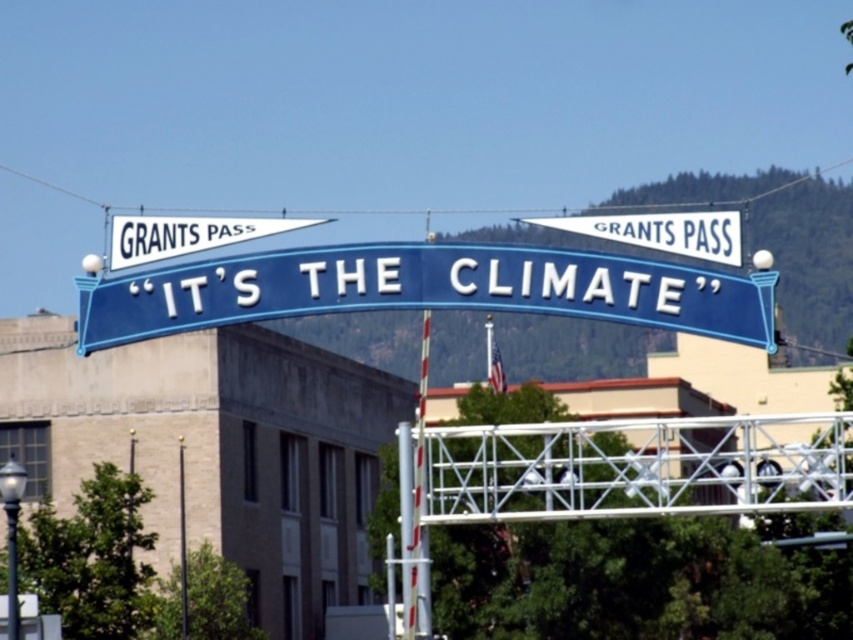
You are standing at the point marked as point (646, 214) in the image. You want to take a photo of the entire archway sign that reads GRANTS PASS and IT S THE CLIMATE. Can you do it from your current position?

The point (646, 214) is 119.83 meters away from the viewer. Since the archway sign is mounted on two vertical poles with spherical decorative elements and is in the background, the distance may be too far to capture the entire archway sign clearly in the photo from that point. However, depending on the camera lens, it might be possible. But based on the given information, the distance is 119.83 meters, which is quite far, so it might not be feasible to capture the entire sign clearly from that position.

You are a delivery person carrying a package that requires a distance of at least 30 meters to safely land using a drone. You have a drone that can deliver to the white paper at center or the smooth metal pole at center. Based on the scene, can the drone deliver the package to either of these locations?

The white paper at center and smooth metal pole at center are 28.52 meters apart from each other. Since the required minimum distance is 30 meters, neither location meets the safety requirement. The drone cannot deliver the package to either the white paper at center or the smooth metal pole at center.

You are a tourist standing on the metal pedestrian bridge in the foreground. You want to take a photo of the blue metallic sign at center and the metallic silver pole at center. Which object should you zoom in on more to ensure both are clearly visible in the frame?

The blue metallic sign at center is smaller than the metallic silver pole at center, so you should zoom in more on the blue metallic sign at center to ensure both are clearly visible in the frame.